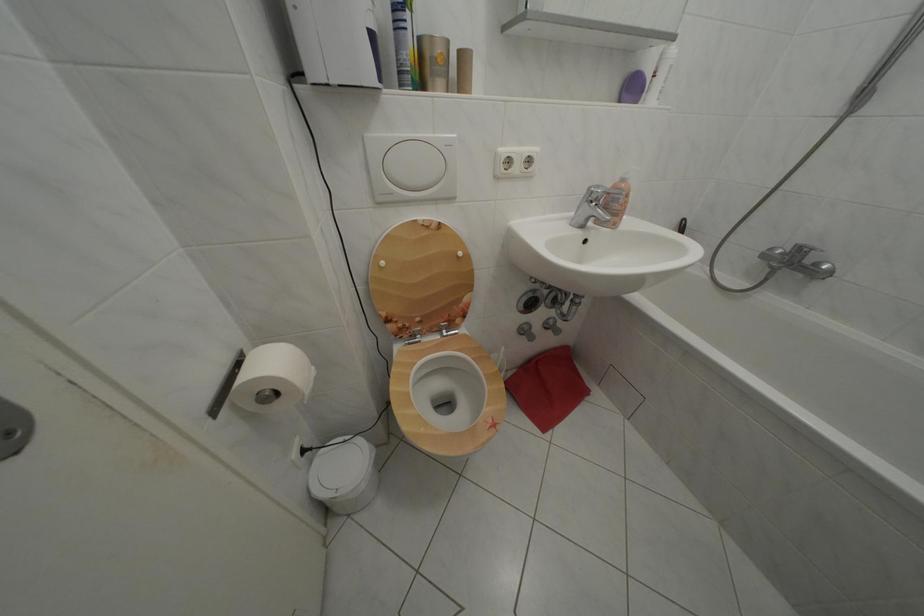
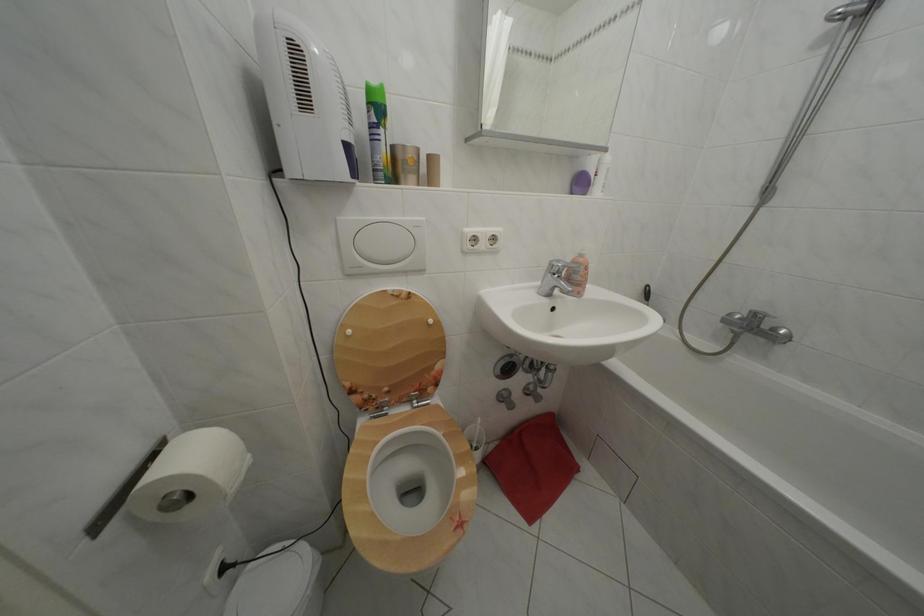
Question: The first image is from the beginning of the video and the second image is from the end. How did the camera likely rotate when shooting the video?

Choices:
 (A) Left
 (B) Right
 (C) Up
 (D) Down

Answer: (C)